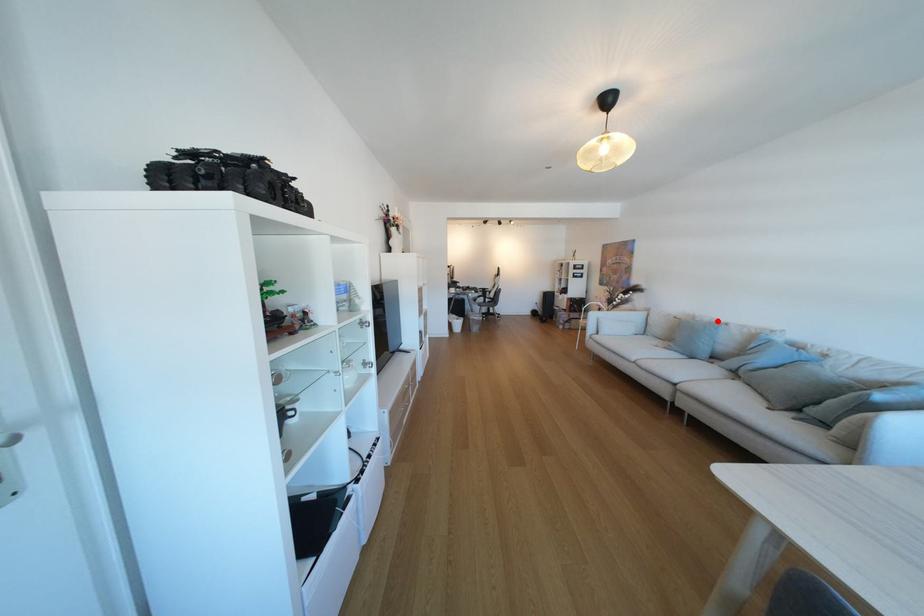
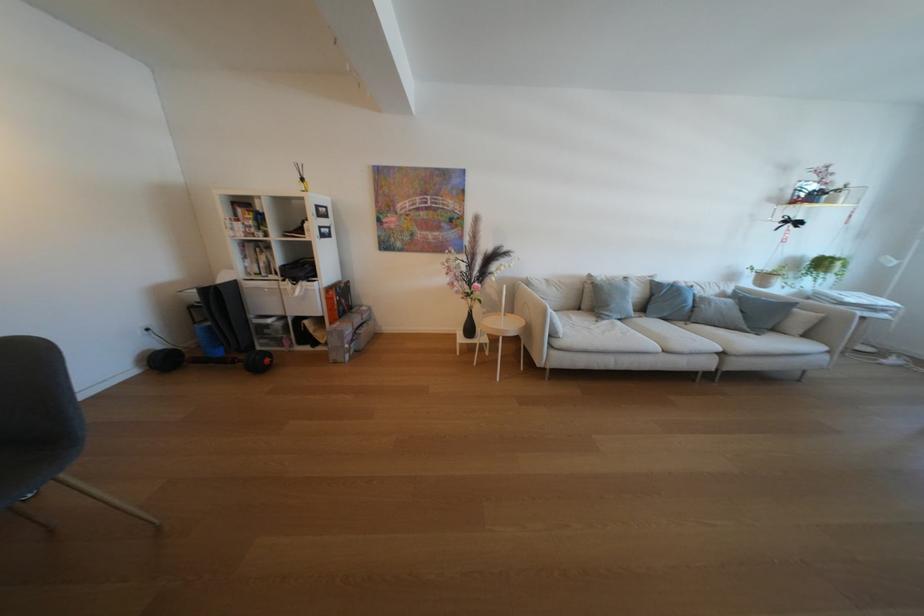
Question: A red point is marked in image1. In image2, is the corresponding 3D point closer to the camera or farther? Reply with the corresponding letter.

Choices:
 (A) The corresponding 3D point is closer.
 (B) The corresponding 3D point is farther.

Answer: (A)